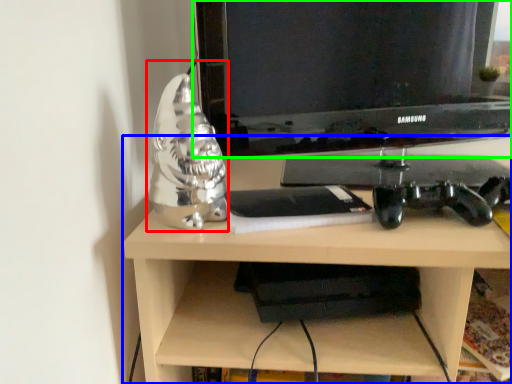
Question: Estimate the real-world distances between objects in this image. Which object is farther from figurine (highlighted by a red box), desk (highlighted by a blue box) or television (highlighted by a green box)?

Choices:
 (A) desk
 (B) television

Answer: (B)